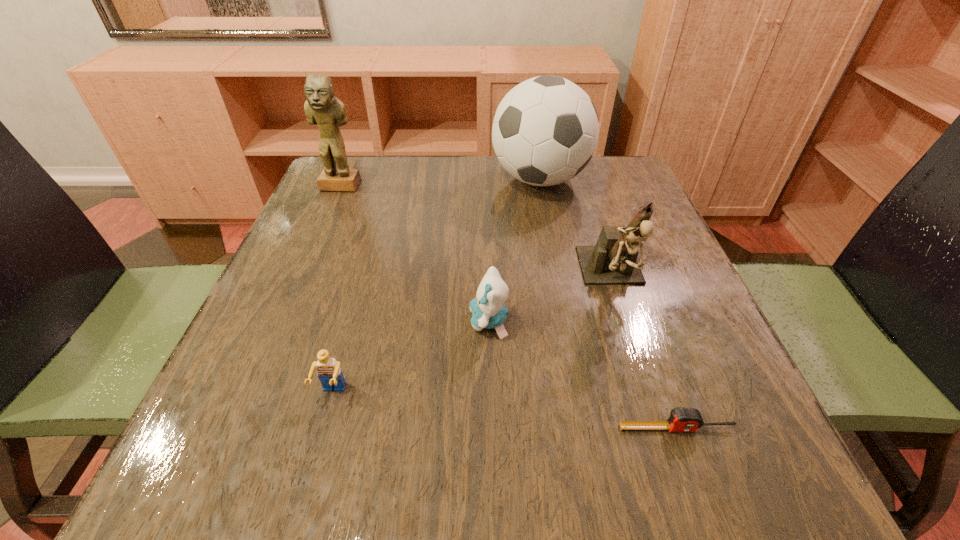
Locate an element on the screen. The width and height of the screenshot is (960, 540). object positioned at the near edge is located at coordinates (681, 419).

Image resolution: width=960 pixels, height=540 pixels. What are the coordinates of `figurine at the left edge` in the screenshot? It's located at (322, 108).

Where is `Lego located at the left edge`? Lego located at the left edge is located at coordinates (329, 372).

Where is `soccer ball positioned at the right edge`? The height and width of the screenshot is (540, 960). soccer ball positioned at the right edge is located at coordinates (545, 131).

Image resolution: width=960 pixels, height=540 pixels. I want to click on figurine located at the right edge, so click(613, 260).

Locate an element on the screen. tape measure that is at the right edge is located at coordinates (681, 419).

Find the location of a particular element. object present at the far left corner is located at coordinates (322, 108).

Identify the location of object located in the far right corner section of the desktop. The width and height of the screenshot is (960, 540). (545, 131).

Image resolution: width=960 pixels, height=540 pixels. Find the location of `object that is positioned at the near right corner`. object that is positioned at the near right corner is located at coordinates (681, 419).

In the image, there is a desktop. Identify the location of vacant space at the far edge. This screenshot has width=960, height=540. (437, 164).